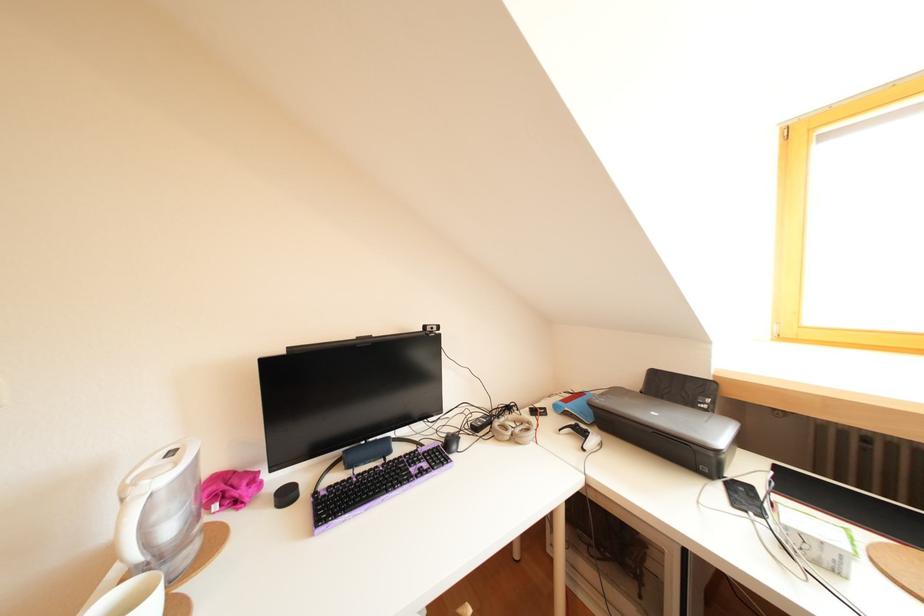
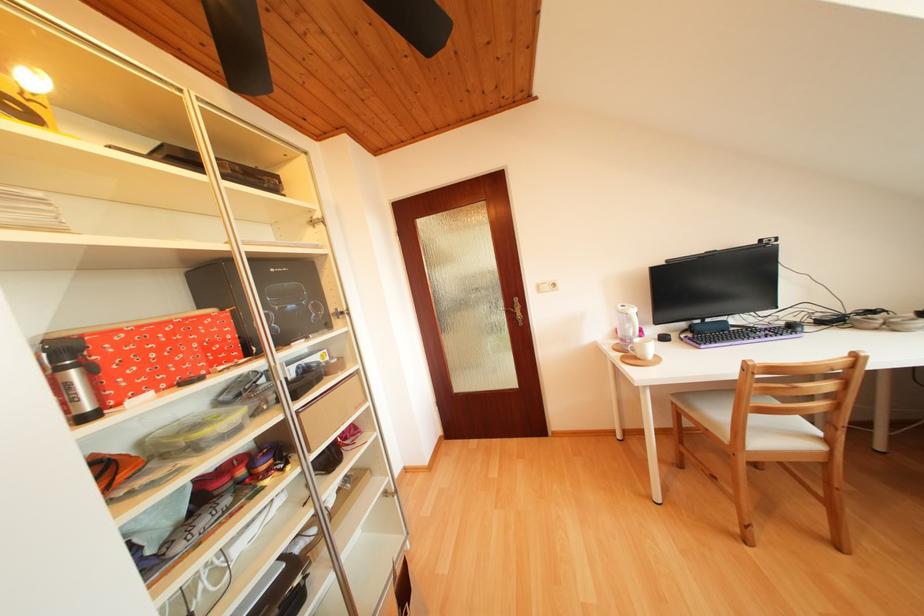
In the second image, find the point that corresponds to point 432,331 in the first image.

(769, 246)